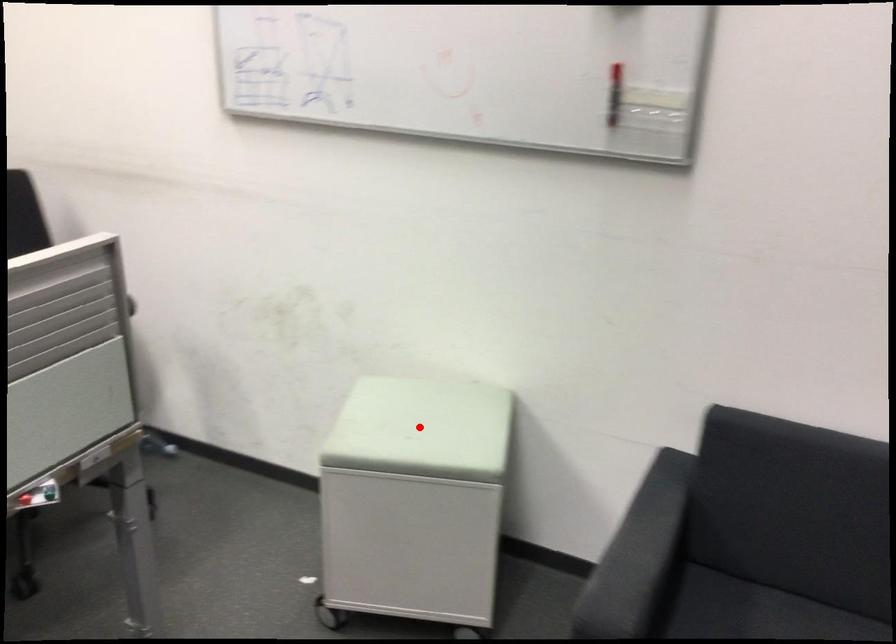
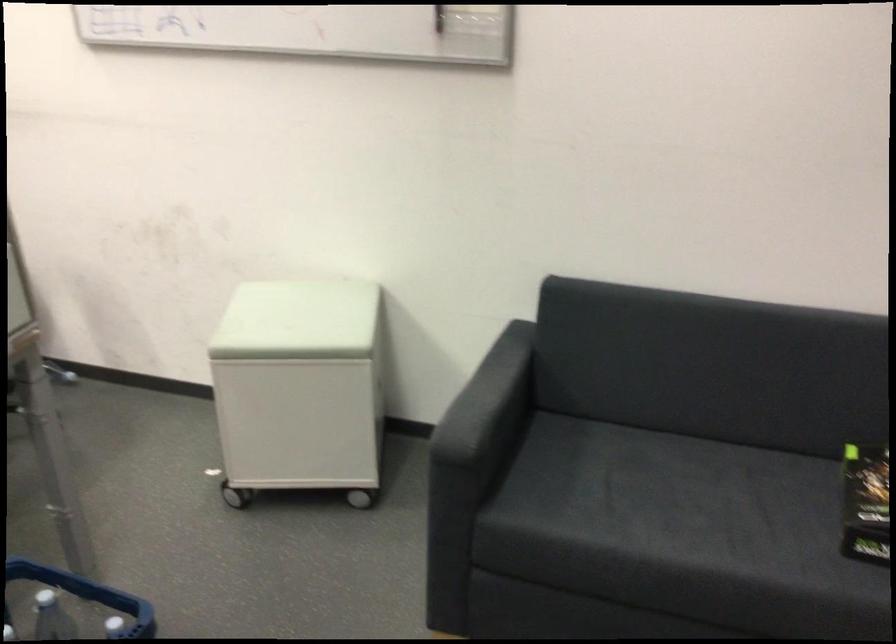
In the second image, find the point that corresponds to the highlighted location in the first image.

(297, 321)